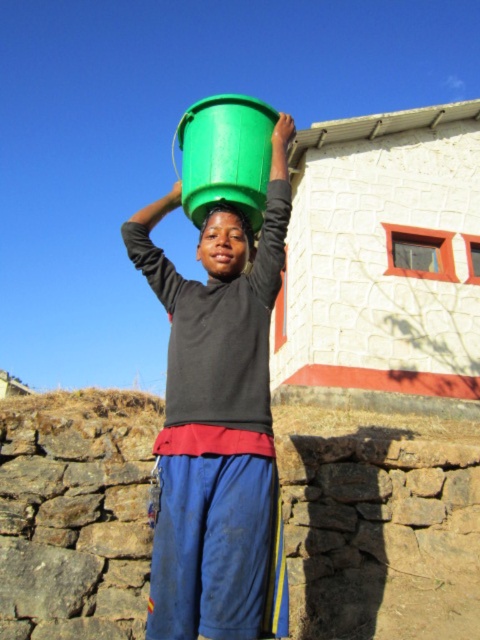
Where is the green plastic bucket at center located in the image?

The green plastic bucket at center is located at point (218, 422).

You are a photographer trying to capture the green plastic bucket at center in the image. The bucket is located at point (218, 422). If you adjust your camera to focus on this point, will the bucket be centered in your photo?

Yes, the green plastic bucket at center is located at point (218, 422), so focusing the camera on this point will center the bucket in the photo.